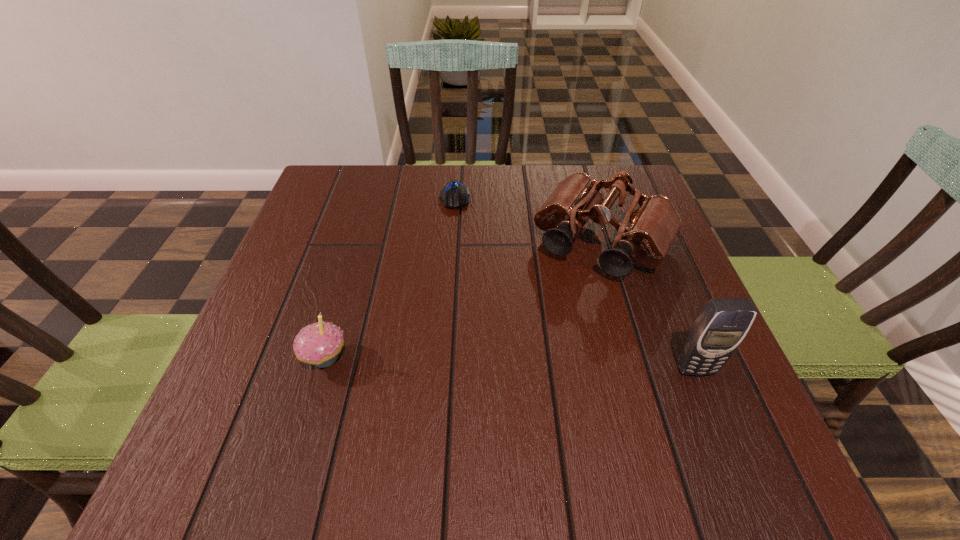
Locate an element on the screen. vacant space located through the eyepieces of the second tallest object is located at coordinates (530, 357).

You are a GUI agent. You are given a task and a screenshot of the screen. Output one action in this format:
    pyautogui.click(x=<x>, y=<y>)
    Task: Click on the free spot located on the button side of the second object from left to right
    Image resolution: width=960 pixels, height=540 pixels.
    Given the screenshot: What is the action you would take?
    pyautogui.click(x=458, y=314)

You are a GUI agent. You are given a task and a screenshot of the screen. Output one action in this format:
    pyautogui.click(x=<x>, y=<y>)
    Task: Click on the vacant space located 0.330m on the button side of the second object from left to right
    The width and height of the screenshot is (960, 540).
    Given the screenshot: What is the action you would take?
    pyautogui.click(x=458, y=310)

I want to click on blank space located on the button side of the second object from left to right, so click(x=457, y=265).

You are a GUI agent. You are given a task and a screenshot of the screen. Output one action in this format:
    pyautogui.click(x=<x>, y=<y>)
    Task: Click on the binoculars that is positioned at the far edge
    
    Given the screenshot: What is the action you would take?
    pyautogui.click(x=650, y=225)

Locate an element on the screen. Image resolution: width=960 pixels, height=540 pixels. computer mouse that is at the far edge is located at coordinates (454, 195).

At what (x,y) coordinates should I click in order to perform the action: click on cupcake located in the near edge section of the desktop. Please return your answer as a coordinate pair (x, y). The width and height of the screenshot is (960, 540). Looking at the image, I should click on (319, 344).

Where is `cellular telephone that is at the near edge`? cellular telephone that is at the near edge is located at coordinates (723, 323).

The height and width of the screenshot is (540, 960). What are the coordinates of `object at the left edge` in the screenshot? It's located at (319, 344).

Locate an element on the screen. cellular telephone positioned at the right edge is located at coordinates (723, 323).